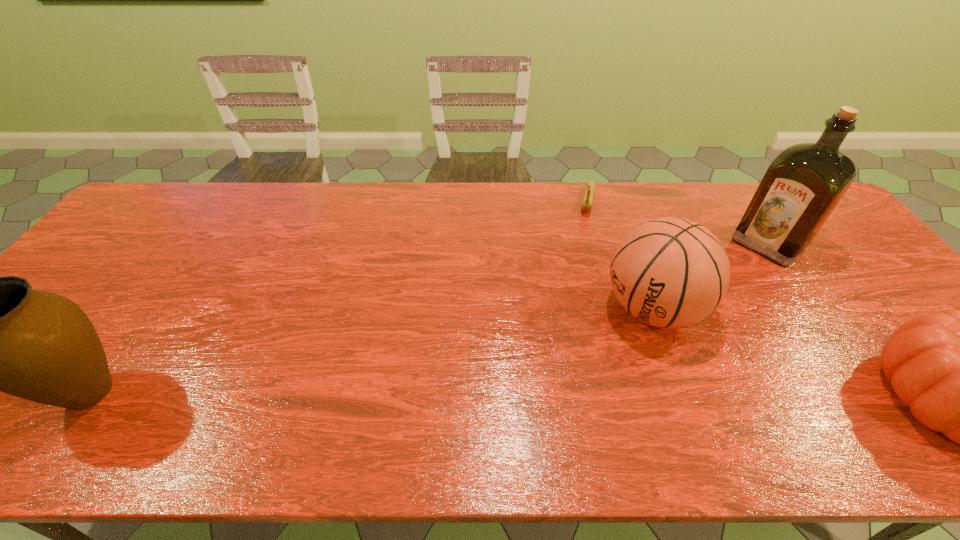
Find the location of `urn`. urn is located at coordinates (0, 334).

Find the location of `basketball`. basketball is located at coordinates (669, 272).

The height and width of the screenshot is (540, 960). In order to click on the farthest object in this screenshot , I will do `click(587, 202)`.

You are a GUI agent. You are given a task and a screenshot of the screen. Output one action in this format:
    pyautogui.click(x=<x>, y=<y>)
    Task: Click on the banana
    The width and height of the screenshot is (960, 540).
    Given the screenshot: What is the action you would take?
    pyautogui.click(x=587, y=202)

Locate an element on the screen. liquor is located at coordinates (802, 186).

The width and height of the screenshot is (960, 540). In order to click on the fourth nearest object in this screenshot , I will do `click(802, 186)`.

The image size is (960, 540). I want to click on vacant region located on the back of the leftmost object, so click(129, 335).

The image size is (960, 540). I want to click on vacant space located on the surface of the basketball near the brand logo, so click(559, 374).

Where is `vacant space situated on the surface of the basketball near the brand logo`? The height and width of the screenshot is (540, 960). vacant space situated on the surface of the basketball near the brand logo is located at coordinates (581, 359).

Where is `vacant space located 0.290m on the surface of the basketball near the brand logo`? The image size is (960, 540). vacant space located 0.290m on the surface of the basketball near the brand logo is located at coordinates (529, 395).